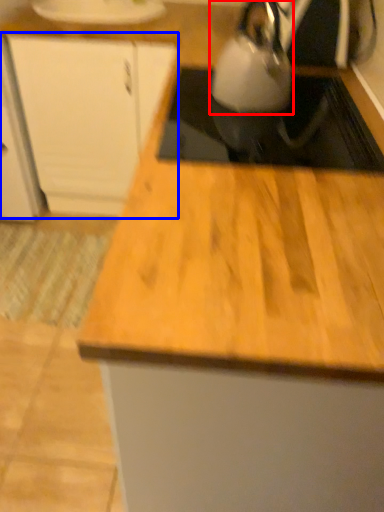
Question: Which object is further to the camera taking this photo, kettle (highlighted by a red box) or cabinetry (highlighted by a blue box)?

Choices:
 (A) kettle
 (B) cabinetry

Answer: (B)